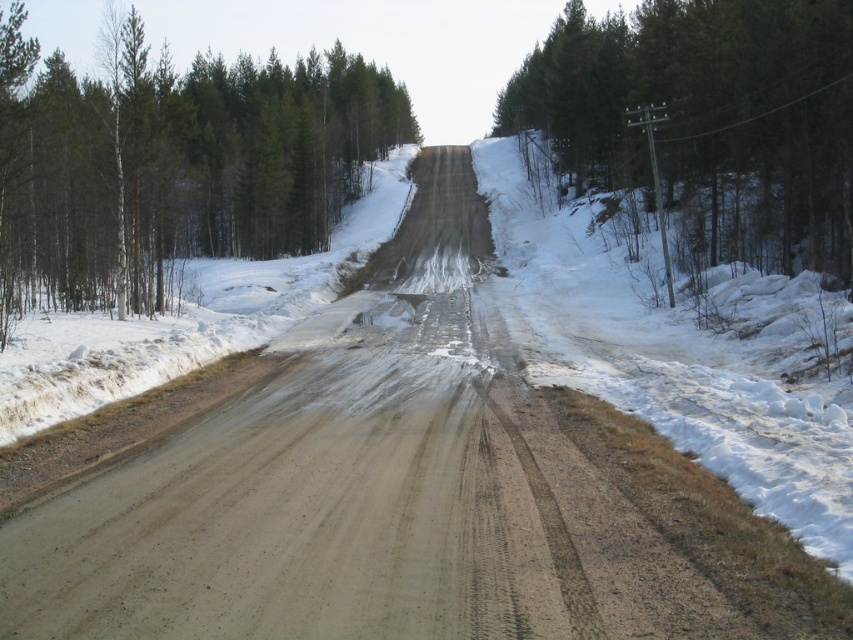
Question: Which of the following is the closest to the observer?

Choices:
 (A) (837, 44)
 (B) (19, 12)

Answer: (B)

Question: In this image, where is green matte tree at upper left located relative to green textured tree at right?

Choices:
 (A) below
 (B) above

Answer: (B)

Question: Which point is closer to the camera taking this photo?

Choices:
 (A) (45, 67)
 (B) (686, 237)

Answer: (B)

Question: From the image, what is the correct spatial relationship of green matte tree at upper left in relation to green textured tree at right?

Choices:
 (A) left
 (B) right

Answer: (A)

Question: Can you confirm if green matte tree at upper left is positioned to the left of green textured tree at right?

Choices:
 (A) yes
 (B) no

Answer: (A)